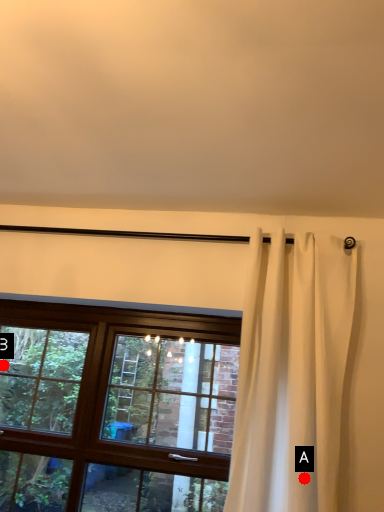
Question: Two points are circled on the image, labeled by A and B beside each circle. Which point is further to the camera?

Choices:
 (A) A is further
 (B) B is further

Answer: (B)